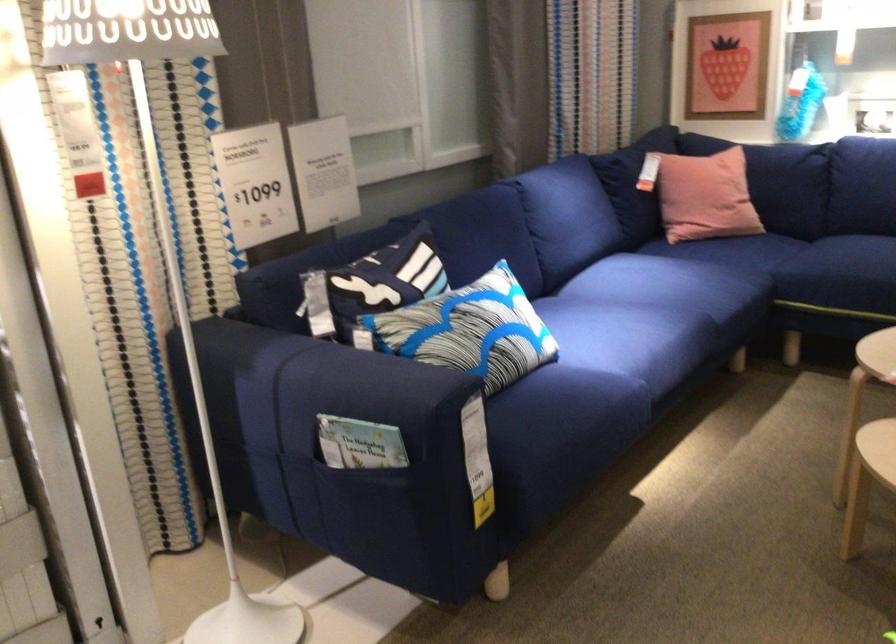
Find the location of a particular element. The height and width of the screenshot is (644, 896). pink pillow is located at coordinates (759, 176).